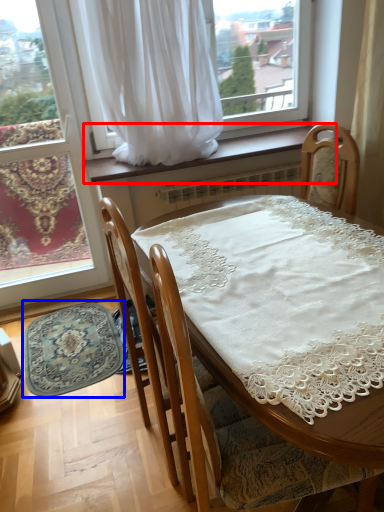
Question: Which object is further to the camera taking this photo, window sill (highlighted by a red box) or mat (highlighted by a blue box)?

Choices:
 (A) window sill
 (B) mat

Answer: (A)